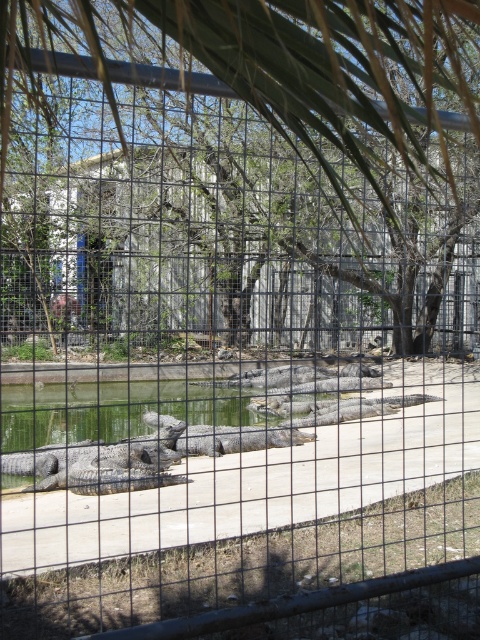
The image size is (480, 640). I want to click on green leafy tree at center, so click(241, 172).

Does point (186, 96) lie in front of point (165, 401)?

Yes, it is.

I want to click on green leafy tree at center, so click(241, 172).

Can you confirm if green leafy tree at center is wider than green matte water at center?

Yes, green leafy tree at center is wider than green matte water at center.

From the picture: Who is positioned more to the right, green leafy tree at center or green matte water at center?

green leafy tree at center is more to the right.

Is point (344, 58) behind point (26, 417)?

No.

You are a GUI agent. You are given a task and a screenshot of the screen. Output one action in this format:
    pyautogui.click(x=<x>, y=<y>)
    Task: Click on the green leafy tree at center
    Image resolution: width=480 pixels, height=640 pixels.
    Given the screenshot: What is the action you would take?
    pyautogui.click(x=241, y=172)

Does gray textured crocodile at center appear over green matte water at center?

Yes, gray textured crocodile at center is above green matte water at center.

Is gray textured crocodile at center positioned behind green matte water at center?

No, gray textured crocodile at center is in front of green matte water at center.

Is point (97, 468) farther from camera compared to point (195, 394)?

No, (97, 468) is closer to viewer.

Identify the location of gray textured crocodile at center. Image resolution: width=480 pixels, height=640 pixels. (210, 422).